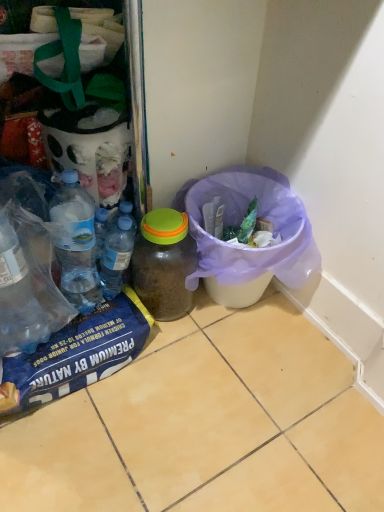
Identify the location of vacant space in front of translucent plastic bottles at center, which ranks as the first bottle in left-to-right order. (71, 335).